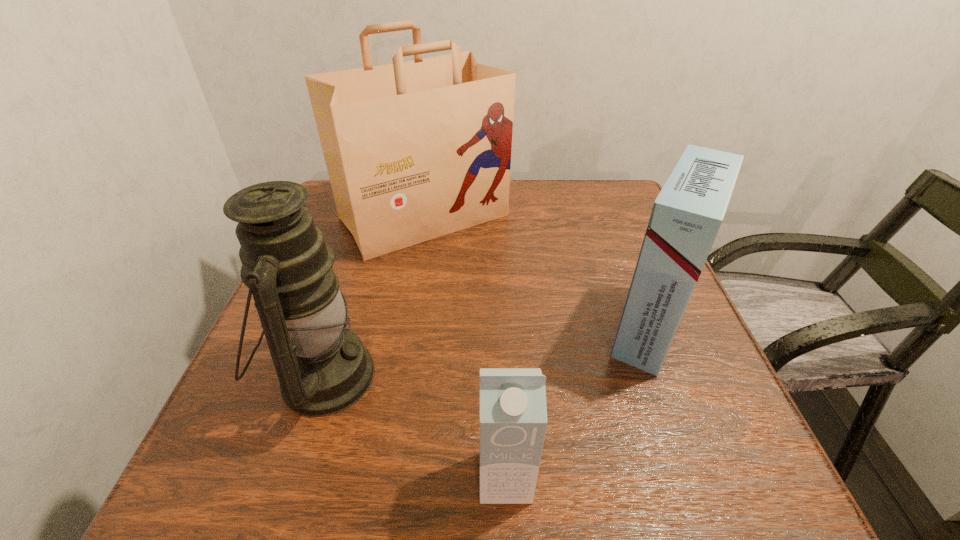
Where is `object that is the nearest to the cigarette case`? This screenshot has height=540, width=960. object that is the nearest to the cigarette case is located at coordinates tap(416, 150).

Where is `free space that satisfies the following two spatial constraints: 1. on the side of the cigarette case with the superhero design; 2. on the left side of the farthest object`? Image resolution: width=960 pixels, height=540 pixels. free space that satisfies the following two spatial constraints: 1. on the side of the cigarette case with the superhero design; 2. on the left side of the farthest object is located at coordinates (405, 328).

You are a GUI agent. You are given a task and a screenshot of the screen. Output one action in this format:
    pyautogui.click(x=<x>, y=<y>)
    Task: Click on the blank space that satisfies the following two spatial constraints: 1. on the back side of the cigarette case; 2. on the right side of the oil lamp
    This screenshot has width=960, height=540.
    Given the screenshot: What is the action you would take?
    pyautogui.click(x=339, y=328)